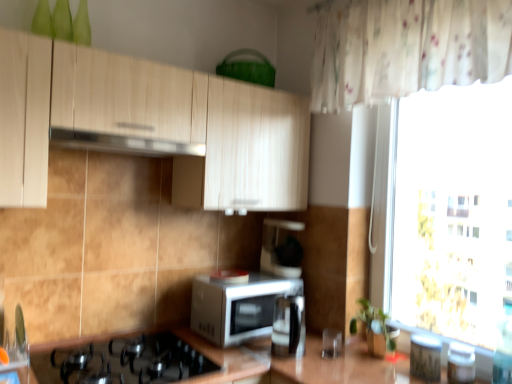
Question: Considering the positions of point (403, 127) and point (239, 339), is point (403, 127) closer or farther from the camera than point (239, 339)?

Choices:
 (A) farther
 (B) closer

Answer: (A)

Question: Relative to white glossy microwave at center, is white sheer curtain at right in front or behind?

Choices:
 (A) behind
 (B) front

Answer: (B)

Question: Which is farther from the light wood cabinet at upper center?

Choices:
 (A) sleek black coffee machine at center
 (B) satin silver kettle at center, which is the 3th appliance from right to left
 (C) metallic silver toaster at right, which is counted as the 3th appliance, starting from the left
 (D) satin silver exhaust hood at upper center
 (E) black matte gas stove at lower left

Answer: (C)

Question: Considering the real-world distances, which object is farthest from the light wood cabinet at upper center?

Choices:
 (A) black matte gas stove at lower left
 (B) white sheer curtain at right
 (C) satin silver exhaust hood at upper center
 (D) sleek black coffee machine at center
 (E) satin silver kettle at center, which is the 3th appliance from right to left

Answer: (B)